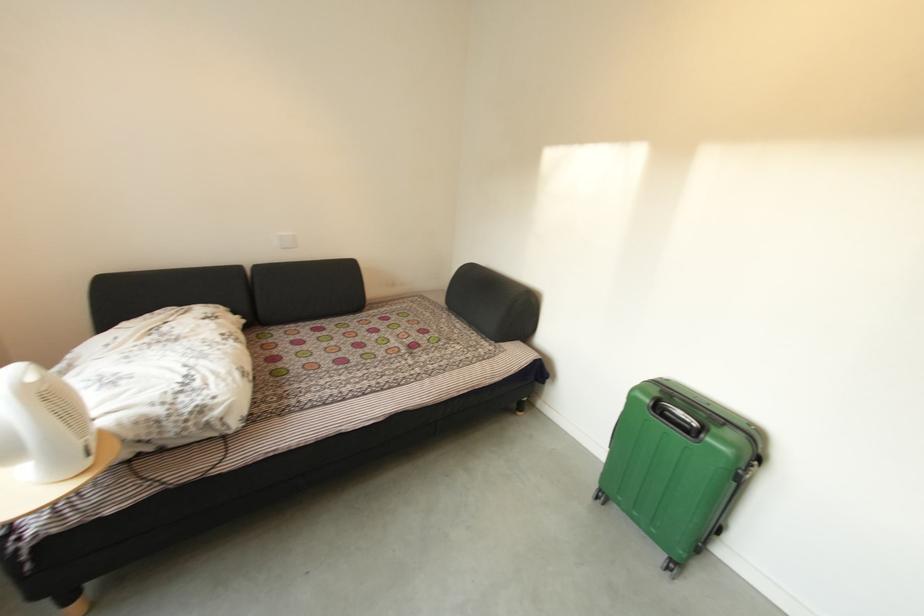
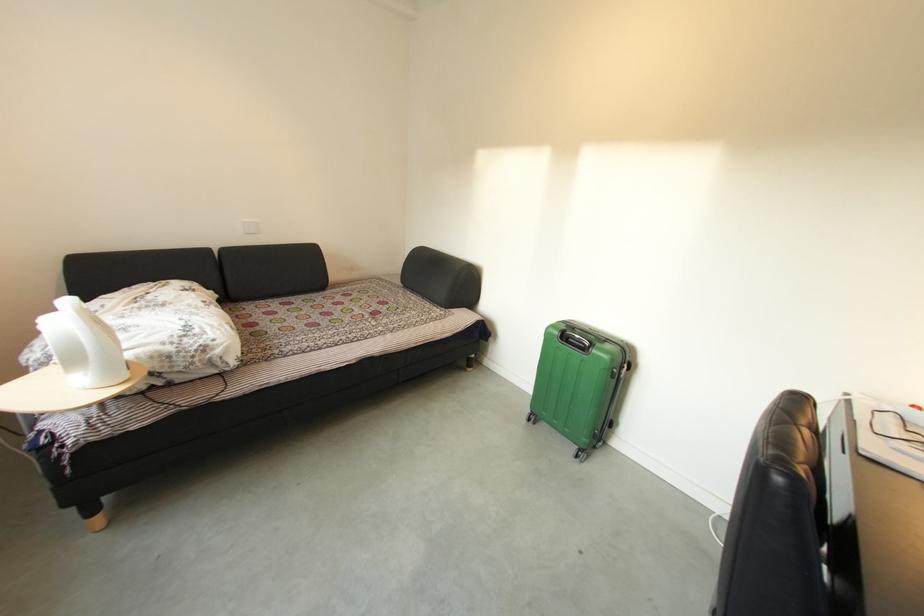
Question: What movement of the cameraman would produce the second image?

Choices:
 (A) Left
 (B) Right
 (C) Forward
 (D) Backward

Answer: (D)